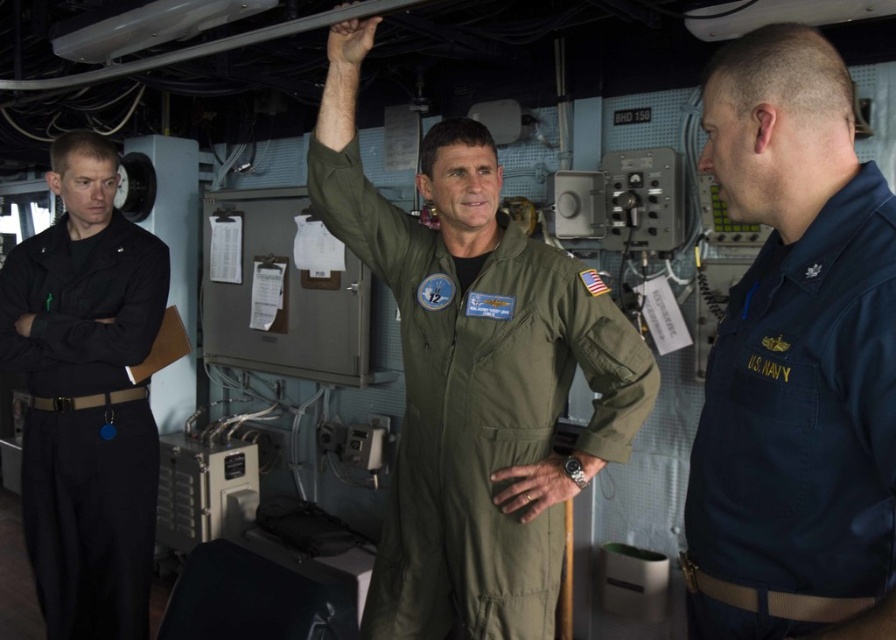
Question: Is navy blue fabric us navy uniform at right to the right of black cotton pants at left from the viewer's perspective?

Choices:
 (A) yes
 (B) no

Answer: (A)

Question: Considering the relative positions of navy blue fabric us navy uniform at right and black cotton pants at left in the image provided, where is navy blue fabric us navy uniform at right located with respect to black cotton pants at left?

Choices:
 (A) above
 (B) below

Answer: (A)

Question: Which of the following is the closest to the observer?

Choices:
 (A) olive green fabric jumpsuit at center
 (B) navy blue fabric us navy uniform at right

Answer: (B)

Question: Can you confirm if olive green fabric jumpsuit at center is positioned below black cotton pants at left?

Choices:
 (A) no
 (B) yes

Answer: (A)

Question: Which of the following is the farthest from the observer?

Choices:
 (A) (507, 248)
 (B) (746, 384)

Answer: (A)

Question: Which object is farther from the camera taking this photo?

Choices:
 (A) black cotton pants at left
 (B) navy blue fabric us navy uniform at right
 (C) olive green fabric jumpsuit at center

Answer: (A)